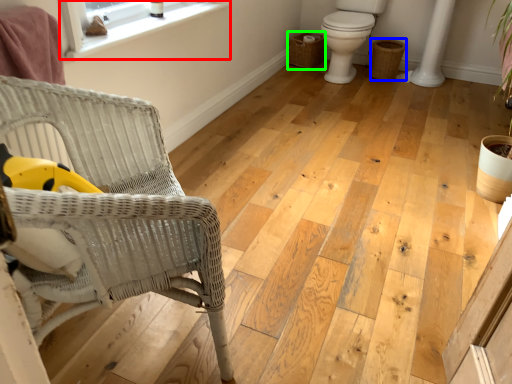
Question: Based on their relative distances, which object is farther from window (highlighted by a red box)? Choose from basket (highlighted by a blue box) and basket (highlighted by a green box).

Choices:
 (A) basket
 (B) basket

Answer: (A)